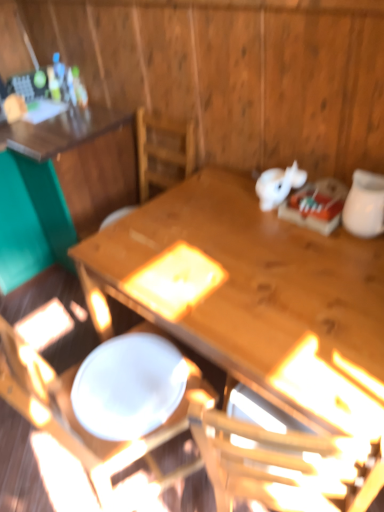
Find the location of a particular element. vacant area to the left of white glossy jar at upper right is located at coordinates (308, 239).